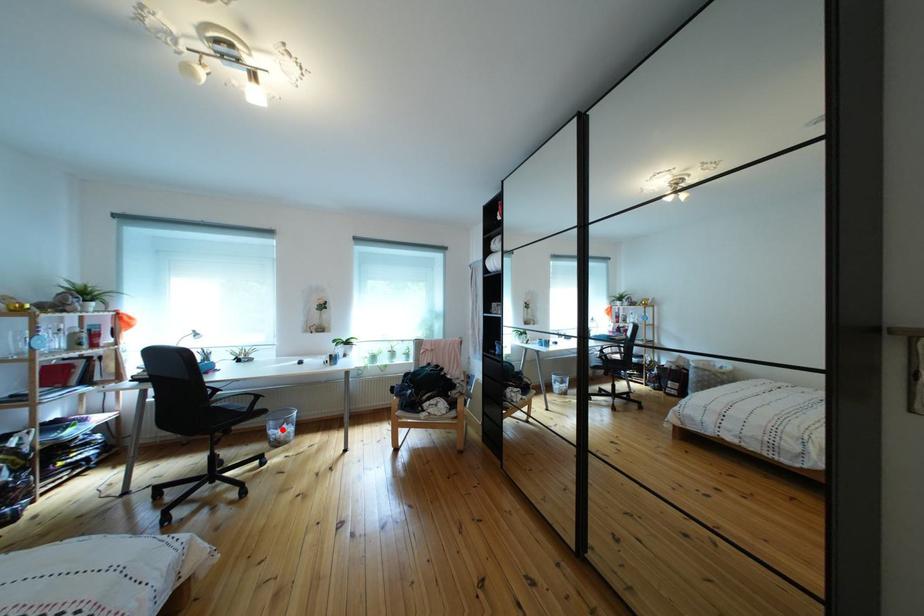
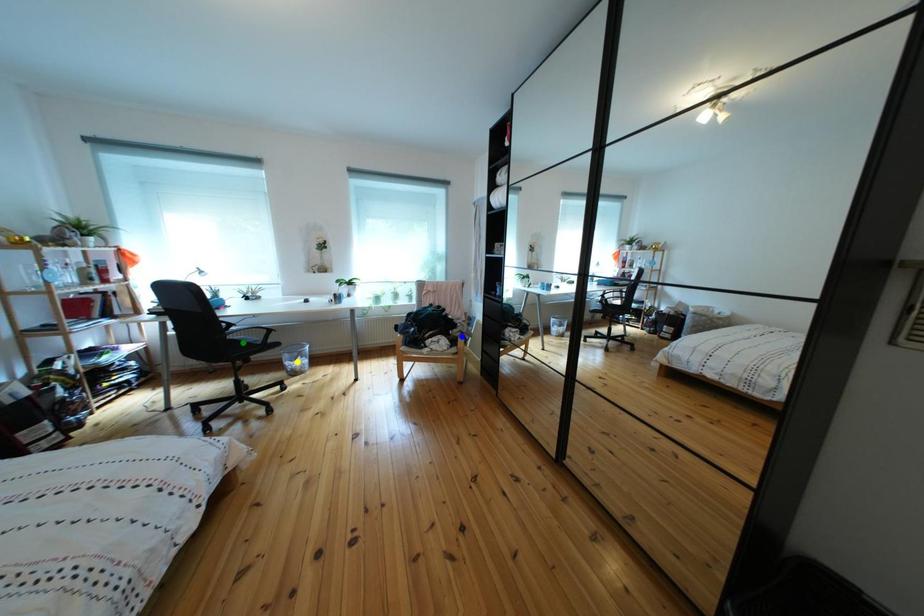
Question: I am providing you with two images of the same scene from different viewpoints. A red point is marked on the first image. You are given multiple points on the second image. Which point in image 2 represents the same 3d spot as the red point in image 1?

Choices:
 (A) yellow point
 (B) blue point
 (C) green point

Answer: (A)